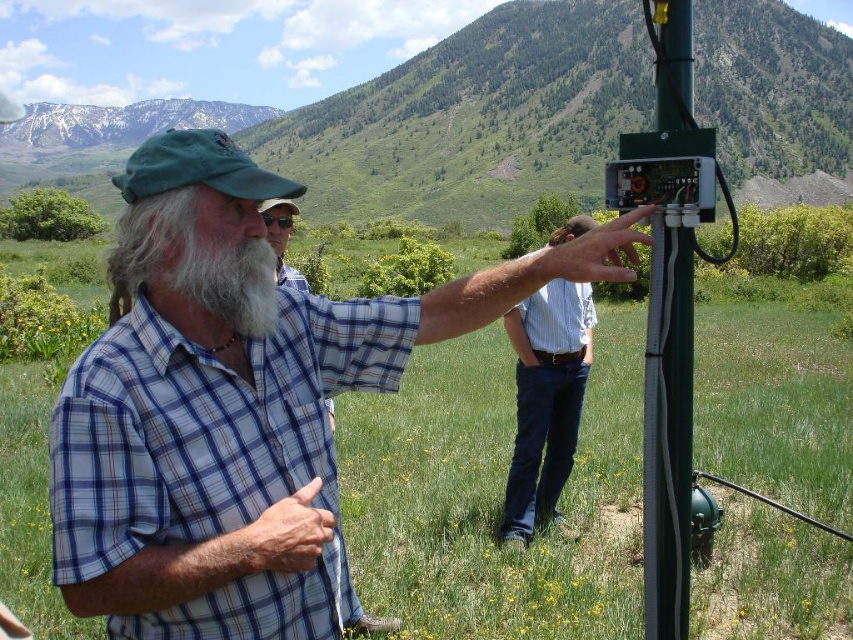
You are a hiker standing at the base of a mountain and see a man in a plaid shirt at center who is 13.12 meters away. If you want to throw a small pebble to get his attention, will it reach him if you can throw up to 12 meters?

The plaid shirt at center is 13.12 meters away from you, which is beyond your throwing range of 12 meters. Therefore, the pebble will not reach him.

You are a fashion designer observing a man in the mountains. You notice the blue jeans at center and the plaid cotton shirt at center. Which clothing item is shorter in length?

The blue jeans at center is shorter than plaid cotton shirt at center.

You are a hiker who wants to take a photo of the plaid shirt at center and the white matte beard at center. Which object should you focus on first if you want both to be in clear focus?

The plaid shirt at center is closer to the viewer than the white matte beard at center, so you should focus on the plaid shirt at center first to ensure both are in clear focus.